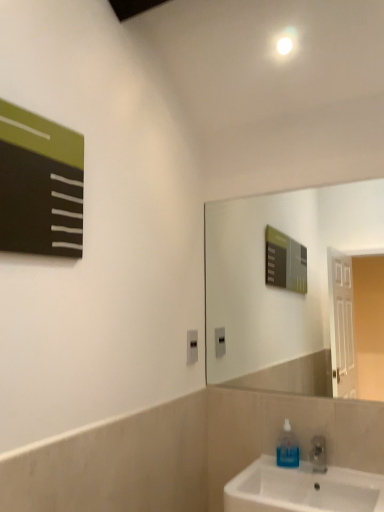
Question: Is point (281, 452) positioned closer to the camera than point (354, 503)?

Choices:
 (A) closer
 (B) farther

Answer: (B)

Question: Relative to white glossy sink at lower right, is transparent blue liquid at sink right in front or behind?

Choices:
 (A) front
 (B) behind

Answer: (B)

Question: Based on their relative distances, which object is nearer to the matte black board at upper left?

Choices:
 (A) white glossy sink at lower right
 (B) transparent blue liquid at sink right
 (C) black plastic outlet at center

Answer: (C)

Question: Which object is the closest to the white glossy sink at lower right?

Choices:
 (A) black plastic outlet at center
 (B) matte black board at upper left
 (C) transparent blue liquid at sink right

Answer: (C)